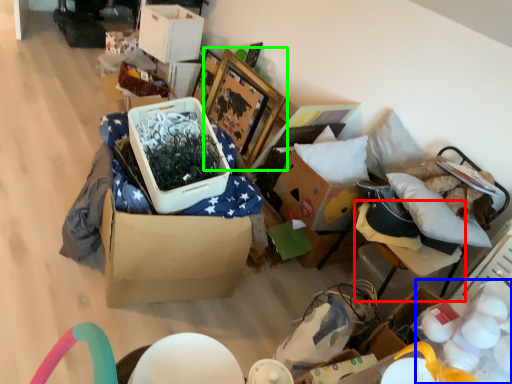
Question: Based on their relative distances, which object is farther from furniture (highlighted by a red box)? Choose from egg (highlighted by a blue box) and picture frame (highlighted by a green box).

Choices:
 (A) egg
 (B) picture frame

Answer: (B)